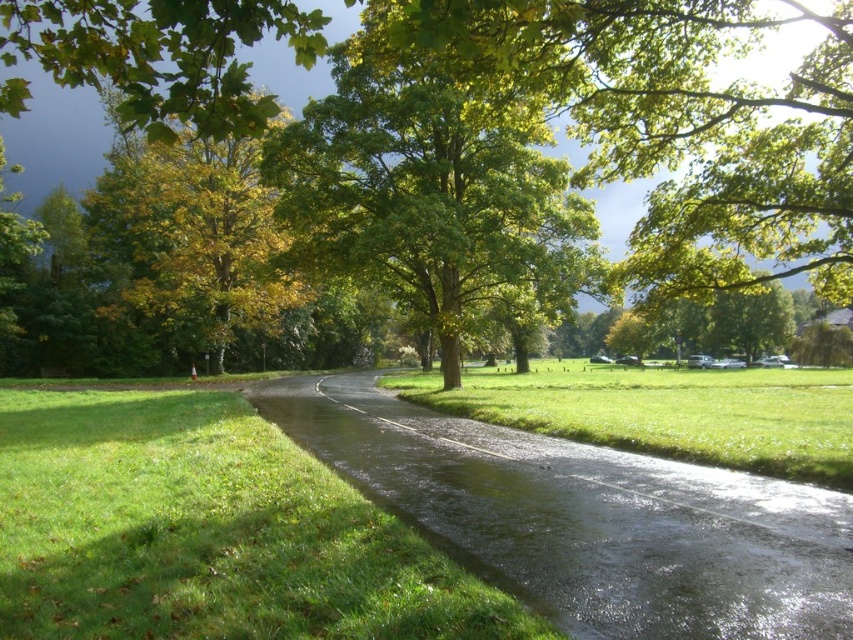
Question: In this image, where is green grass at lower left located relative to green grassy at center?

Choices:
 (A) left
 (B) right

Answer: (A)

Question: Does green grass at lower left lie in front of green leafy tree at center?

Choices:
 (A) no
 (B) yes

Answer: (B)

Question: Observing the image, what is the correct spatial positioning of green leafy tree at center in reference to green grassy at center?

Choices:
 (A) right
 (B) left

Answer: (B)

Question: Among these objects, which one is nearest to the camera?

Choices:
 (A) green grassy at center
 (B) yellow-green leaves at upper left

Answer: (B)

Question: Which point is closer to the camera?

Choices:
 (A) green leafy tree at center
 (B) green grassy at center
 (C) yellow-green leaves at upper left
 (D) green grass at lower left

Answer: (C)

Question: Which object appears farthest from the camera in this image?

Choices:
 (A) green grass at lower left
 (B) green leafy tree at center

Answer: (B)